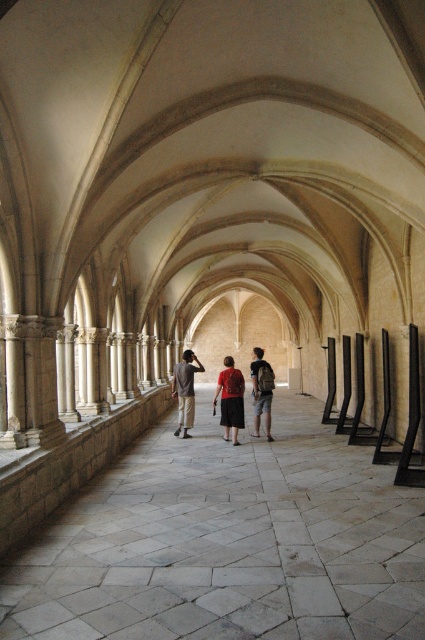
Question: Which of these objects is positioned closest to the khaki cotton pants at center?

Choices:
 (A) matte red blouse at center
 (B) light brown backpack at center

Answer: (A)

Question: Does gray stone walkway at center lie in front of light brown backpack at center?

Choices:
 (A) no
 (B) yes

Answer: (B)

Question: Which point is closer to the camera?

Choices:
 (A) (223, 419)
 (B) (195, 579)
 (C) (255, 378)

Answer: (B)

Question: Based on their relative distances, which object is farther from the khaki cotton pants at center?

Choices:
 (A) matte red blouse at center
 (B) gray stone walkway at center

Answer: (B)

Question: Is gray stone walkway at center smaller than khaki cotton pants at center?

Choices:
 (A) no
 (B) yes

Answer: (B)

Question: Can you confirm if gray stone walkway at center is thinner than khaki cotton pants at center?

Choices:
 (A) no
 (B) yes

Answer: (A)